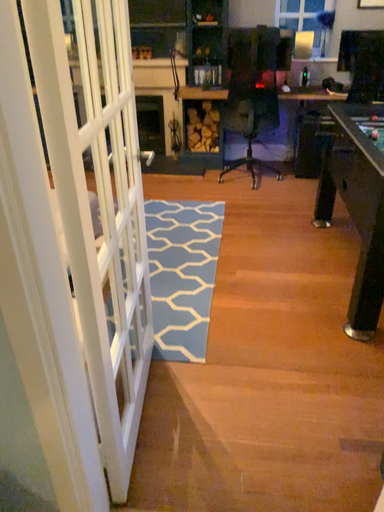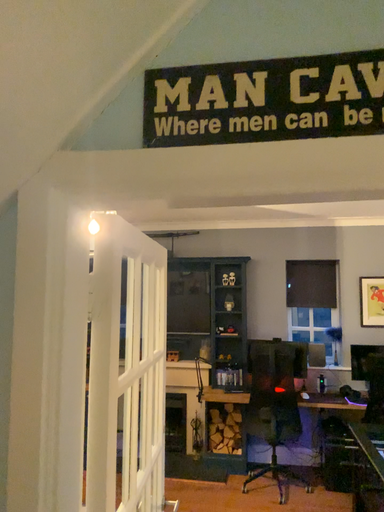
Question: Which way did the camera rotate in the video?

Choices:
 (A) rotated upward
 (B) rotated downward

Answer: (A)